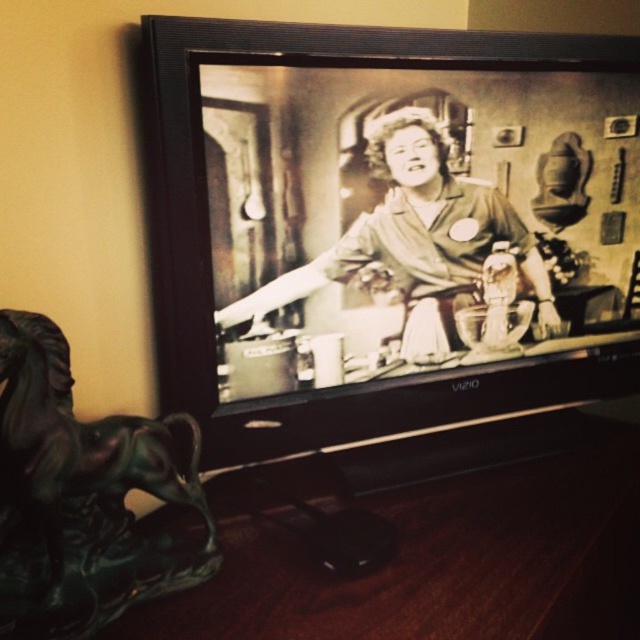
You are standing in a living room and want to place a new picture frame on the wall. The frame is 1 meter tall. The black matte television at center is currently above the matte black dress at center. Is there enough vertical space between them to hang the frame?

The black matte television at center is above the matte black dress at center, so there is vertical space between them. However, the exact distance isn

You are an interior designer assessing the living room layout. You have a new decorative item that needs to be placed in front of the black matte television at center. The item is 0.5 meters wide. Considering the size of the matte black dress at center currently in front, will there be enough space to place the new item without moving the existing dress?

The black matte television at center is bigger than the matte black dress at center. Since the television is larger, there should be sufficient space to place the new 0.5 meter wide item next to or around the existing dress without needing to move it.

You are a delivery person who needs to place a small package between the black matte television at center and the matte black dress at center. Can you fit it there?

The distance between the black matte television at center and the matte black dress at center is 2.00 inches, which is too narrow to fit a small package. You will need to choose another location.